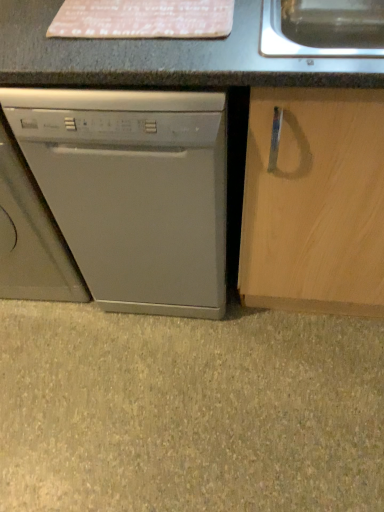
This screenshot has width=384, height=512. What do you see at coordinates (189, 411) in the screenshot?
I see `gray matte dishwasher at lower left` at bounding box center [189, 411].

Measure the distance between gray matte dishwasher at lower left and camera.

gray matte dishwasher at lower left is 3.59 feet away from camera.

The height and width of the screenshot is (512, 384). In order to click on gray matte dishwasher at lower left in this screenshot , I will do `click(189, 411)`.

Find the location of a particular element. Image resolution: width=384 pixels, height=512 pixels. satin silver dishwasher at left is located at coordinates pyautogui.click(x=133, y=191).

What is the approximate width of satin silver dishwasher at left?

The width of satin silver dishwasher at left is 24.92 inches.

Describe the element at coordinates (133, 191) in the screenshot. This screenshot has height=512, width=384. I see `satin silver dishwasher at left` at that location.

At what (x,y) coordinates should I click in order to perform the action: click on gray matte dishwasher at lower left. Please return your answer as a coordinate pair (x, y). Looking at the image, I should click on (189, 411).

Based on the photo, which object is positioned more to the right, gray matte dishwasher at lower left or satin silver dishwasher at left?

gray matte dishwasher at lower left is more to the right.

Relative to satin silver dishwasher at left, is gray matte dishwasher at lower left in front or behind?

Clearly, gray matte dishwasher at lower left is behind satin silver dishwasher at left.

Which is nearer, [371,467] or [66,178]?

Point [371,467] is farther from the camera than point [66,178].

From the image's perspective, which one is positioned lower, gray matte dishwasher at lower left or satin silver dishwasher at left?

gray matte dishwasher at lower left is shown below in the image.

From a real-world perspective, is gray matte dishwasher at lower left beneath satin silver dishwasher at left?

Yes, from a real-world perspective, gray matte dishwasher at lower left is under satin silver dishwasher at left.

Can you confirm if gray matte dishwasher at lower left is thinner than satin silver dishwasher at left?

Incorrect, the width of gray matte dishwasher at lower left is not less than that of satin silver dishwasher at left.

Considering the relative sizes of gray matte dishwasher at lower left and satin silver dishwasher at left in the image provided, is gray matte dishwasher at lower left shorter than satin silver dishwasher at left?

Yes, gray matte dishwasher at lower left is shorter than satin silver dishwasher at left.

Can you confirm if gray matte dishwasher at lower left is bigger than satin silver dishwasher at left?

No.

Is gray matte dishwasher at lower left not inside satin silver dishwasher at left?

Indeed, gray matte dishwasher at lower left is completely outside satin silver dishwasher at left.

Is there a large distance between gray matte dishwasher at lower left and satin silver dishwasher at left?

Actually, gray matte dishwasher at lower left and satin silver dishwasher at left are a little close together.

Is gray matte dishwasher at lower left facing away from satin silver dishwasher at left?

Absolutely, gray matte dishwasher at lower left is directed away from satin silver dishwasher at left.

Where is `concrete behind the satin silver dishwasher at left`? Image resolution: width=384 pixels, height=512 pixels. concrete behind the satin silver dishwasher at left is located at coordinates (189, 411).

Is satin silver dishwasher at left at the right side of gray matte dishwasher at lower left?

Incorrect, satin silver dishwasher at left is not on the right side of gray matte dishwasher at lower left.

Which object is more forward, satin silver dishwasher at left or gray matte dishwasher at lower left?

satin silver dishwasher at left.

Does point (87, 145) appear closer or farther from the camera than point (306, 346)?

Point (87, 145) is positioned closer to the camera compared to point (306, 346).

From the image's perspective, between satin silver dishwasher at left and gray matte dishwasher at lower left, who is located below?

From the image's view, gray matte dishwasher at lower left is below.

From a real-world perspective, is satin silver dishwasher at left above or below gray matte dishwasher at lower left?

satin silver dishwasher at left is above gray matte dishwasher at lower left.

Looking at this image, which of these two, satin silver dishwasher at left or gray matte dishwasher at lower left, is wider?

gray matte dishwasher at lower left is wider.

Which of these two, satin silver dishwasher at left or gray matte dishwasher at lower left, stands shorter?

Standing shorter between the two is gray matte dishwasher at lower left.

Between satin silver dishwasher at left and gray matte dishwasher at lower left, which one has larger size?

satin silver dishwasher at left.

Looking at this image, choose the correct answer: Is satin silver dishwasher at left inside gray matte dishwasher at lower left or outside it?

satin silver dishwasher at left is not inside gray matte dishwasher at lower left, it's outside.

Would you say satin silver dishwasher at left is a long distance from gray matte dishwasher at lower left?

No, satin silver dishwasher at left is in close proximity to gray matte dishwasher at lower left.

Is gray matte dishwasher at lower left at the back of satin silver dishwasher at left?

No, satin silver dishwasher at left is not facing the opposite direction of gray matte dishwasher at lower left.

How many degrees apart are the facing directions of satin silver dishwasher at left and gray matte dishwasher at lower left?

They differ by 4.75e-06 degrees in their facing directions.

Where is `concrete beneath the satin silver dishwasher at left (from a real-world perspective)`? This screenshot has height=512, width=384. concrete beneath the satin silver dishwasher at left (from a real-world perspective) is located at coordinates (189, 411).

I want to click on washing machine lying in front of the gray matte dishwasher at lower left, so click(x=133, y=191).

The image size is (384, 512). What are the coordinates of `concrete lying below the satin silver dishwasher at left (from the image's perspective)` in the screenshot? It's located at (189, 411).